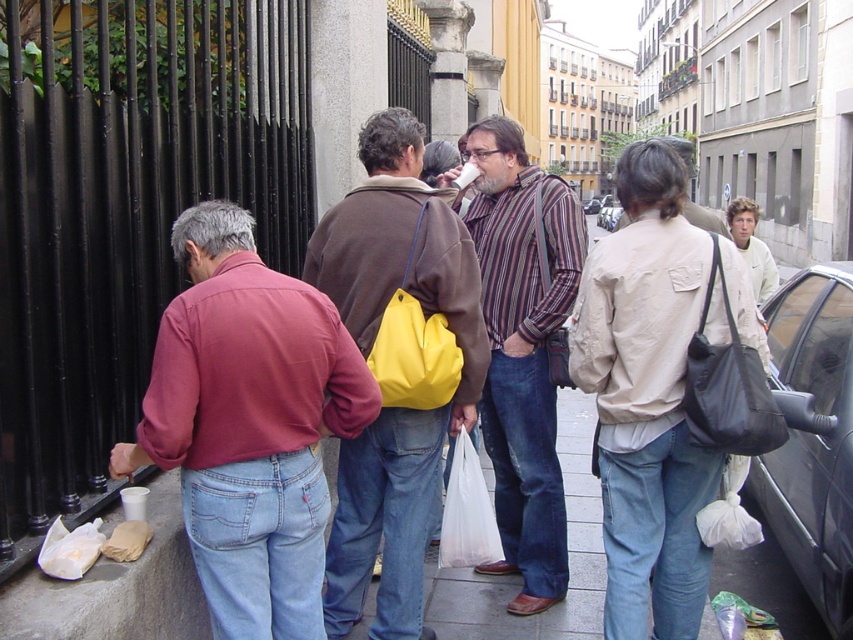
Question: Can you confirm if white fleece jacket at upper right is wider than metallic silver car at center?

Choices:
 (A) no
 (B) yes

Answer: (B)

Question: Which point appears farthest from the camera in this image?

Choices:
 (A) click(618, 202)
 (B) click(459, 292)
 (C) click(44, 605)
 (D) click(753, 268)

Answer: (A)

Question: Is white paper bag at lower left to the right of white fleece jacket at upper right from the viewer's perspective?

Choices:
 (A) no
 (B) yes

Answer: (A)

Question: Which of the following is the farthest from the observer?

Choices:
 (A) (189, 332)
 (B) (363, 257)

Answer: (B)

Question: Does brown leather jacket at center lie in front of white plastic bag at lower center?

Choices:
 (A) no
 (B) yes

Answer: (B)

Question: Which object is positioned farthest from the brown leather jacket at center?

Choices:
 (A) matte red shirt at left
 (B) yellow leather bag at center
 (C) black glossy car at right

Answer: (C)